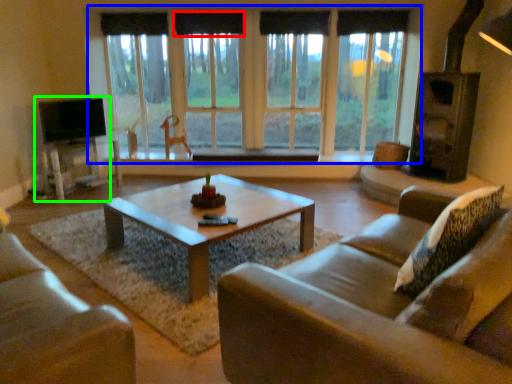
Question: Estimate the real-world distances between objects in this image. Which object is farther from curtain (highlighted by a red box), window (highlighted by a blue box) or entertainment center (highlighted by a green box)?

Choices:
 (A) window
 (B) entertainment center

Answer: (B)